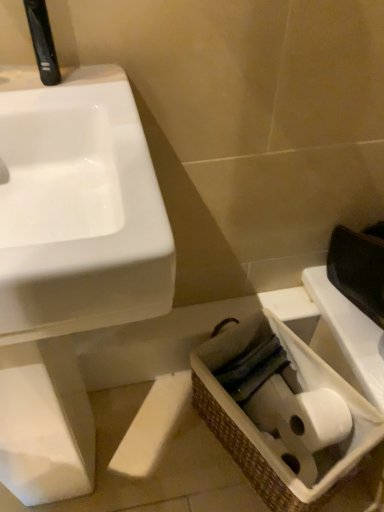
Question: Is black plastic faucet at upper left directly adjacent to white glossy sink at left?

Choices:
 (A) no
 (B) yes

Answer: (A)

Question: Does black plastic faucet at upper left have a larger size compared to white glossy sink at left?

Choices:
 (A) yes
 (B) no

Answer: (B)

Question: Considering the relative positions of black plastic faucet at upper left and white glossy sink at left in the image provided, is black plastic faucet at upper left behind white glossy sink at left?

Choices:
 (A) yes
 (B) no

Answer: (A)

Question: From the image's perspective, is black plastic faucet at upper left above white glossy sink at left?

Choices:
 (A) yes
 (B) no

Answer: (A)

Question: Is white glossy sink at left located within black plastic faucet at upper left?

Choices:
 (A) no
 (B) yes

Answer: (A)

Question: Looking at the image, does woven brown basket at lower right seem bigger or smaller compared to white glossy sink at left?

Choices:
 (A) big
 (B) small

Answer: (B)

Question: From the image's perspective, relative to white glossy sink at left, is woven brown basket at lower right above or below?

Choices:
 (A) below
 (B) above

Answer: (A)

Question: Is woven brown basket at lower right taller or shorter than white glossy sink at left?

Choices:
 (A) tall
 (B) short

Answer: (B)

Question: Is woven brown basket at lower right inside the boundaries of white glossy sink at left, or outside?

Choices:
 (A) outside
 (B) inside

Answer: (A)

Question: Would you say white glossy sink at left is to the left or to the right of black plastic faucet at upper left in the picture?

Choices:
 (A) left
 (B) right

Answer: (A)

Question: Is point (145, 227) closer or farther from the camera than point (33, 40)?

Choices:
 (A) closer
 (B) farther

Answer: (A)

Question: Is white glossy sink at left inside or outside of black plastic faucet at upper left?

Choices:
 (A) inside
 (B) outside

Answer: (B)

Question: Is white glossy sink at left in front of or behind black plastic faucet at upper left in the image?

Choices:
 (A) behind
 (B) front

Answer: (B)

Question: Relative to white glossy sink at left, is black plastic faucet at upper left in front or behind?

Choices:
 (A) behind
 (B) front

Answer: (A)

Question: Visually, is black plastic faucet at upper left positioned to the left or to the right of white glossy sink at left?

Choices:
 (A) left
 (B) right

Answer: (B)